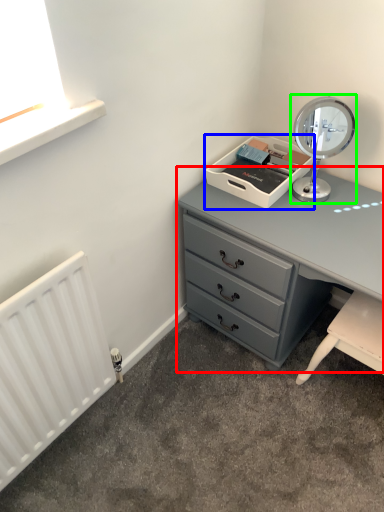
Question: Estimate the real-world distances between objects in this image. Which object is closer to chest of drawers (highlighted by a red box), printer (highlighted by a blue box) or table lamp (highlighted by a green box)?

Choices:
 (A) printer
 (B) table lamp

Answer: (A)